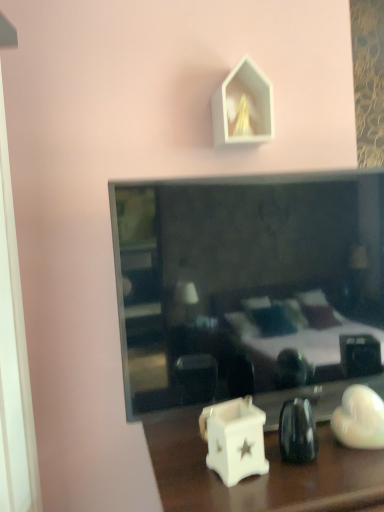
Locate an element on the screen. This screenshot has width=384, height=512. blank area to the left of white ceramic candle holder at lower center is located at coordinates (175, 473).